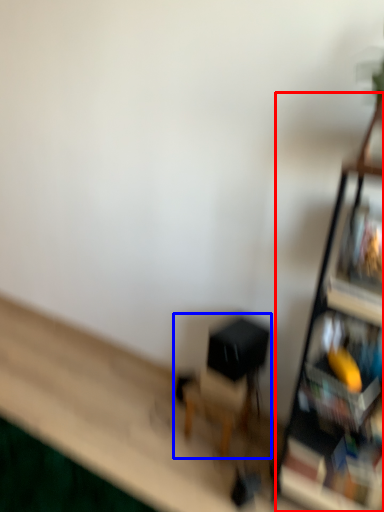
Question: Which object appears farthest to the camera in this image, shelf (highlighted by a red box) or swivel chair (highlighted by a blue box)?

Choices:
 (A) shelf
 (B) swivel chair

Answer: (B)